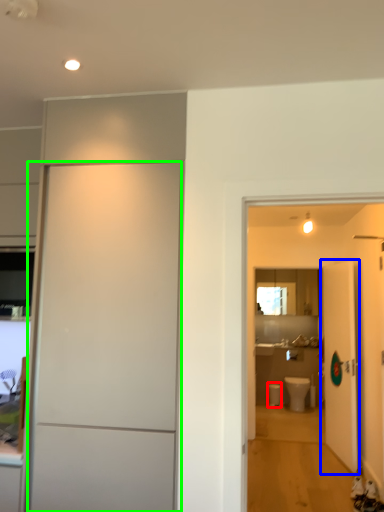
Question: Which object is positioned closest to toilet bowl (highlighted by a red box)? Select from door (highlighted by a blue box) and door (highlighted by a green box).

Choices:
 (A) door
 (B) door

Answer: (A)